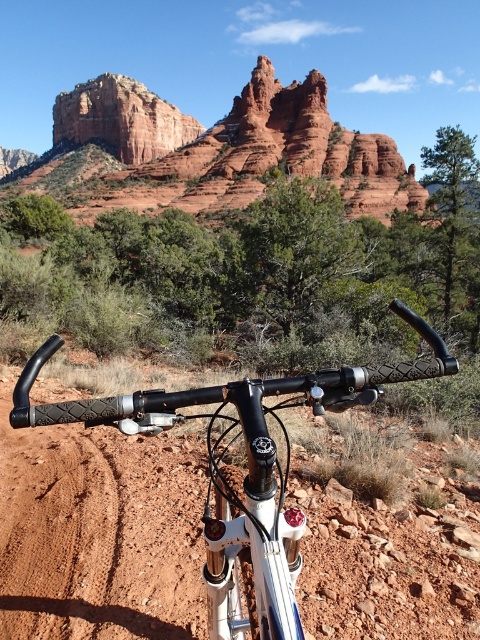
Question: Can you confirm if reddish-brown rock formation at upper center is positioned to the left of rubber textured handlebars at center?

Choices:
 (A) no
 (B) yes

Answer: (B)

Question: Can you confirm if reddish-brown rock formation at upper center is positioned below rubber textured handlebars at center?

Choices:
 (A) yes
 (B) no

Answer: (B)

Question: Which point is closer to the camera taking this photo?

Choices:
 (A) (238, 541)
 (B) (139, 102)

Answer: (A)

Question: Which point appears farthest from the camera in this image?

Choices:
 (A) (202, 209)
 (B) (313, 412)

Answer: (A)

Question: Does reddish-brown rock formation at upper center have a larger size compared to rubber textured handlebars at center?

Choices:
 (A) no
 (B) yes

Answer: (B)